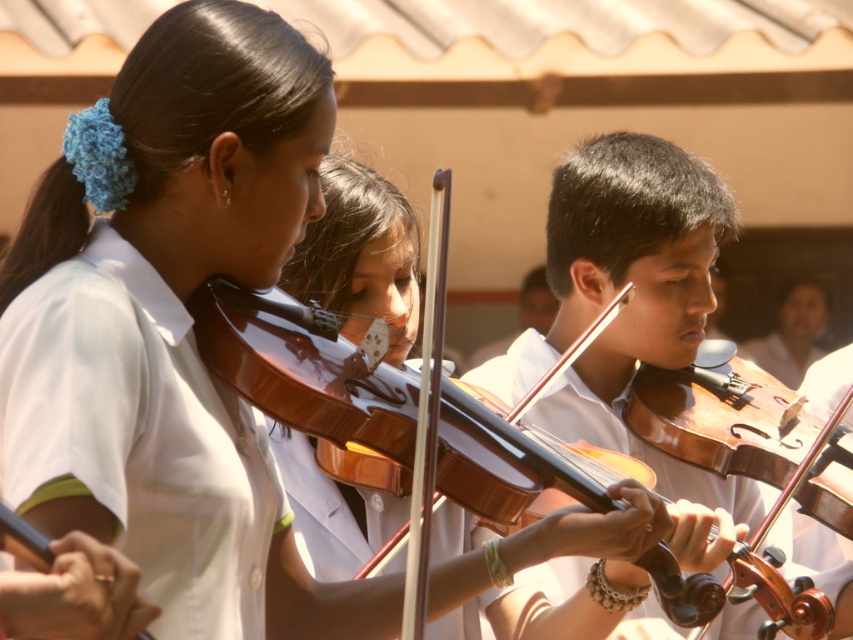
Based on the photo, you are a music teacher observing the violinists. You notice two violins at center. Which violin is closer to you, the wooden violin at center or the shiny brown violin at center?

The wooden violin at center is closer to you because the shiny brown violin at center is positioned behind it.

You are a photographer trying to capture the wooden violin at center in your shot. Based on the coordinates provided, where exactly should you aim your camera to ensure the violin is centered in the frame?

To center the wooden violin at center in your frame, aim your camera at the coordinates point (628, 304) as specified.